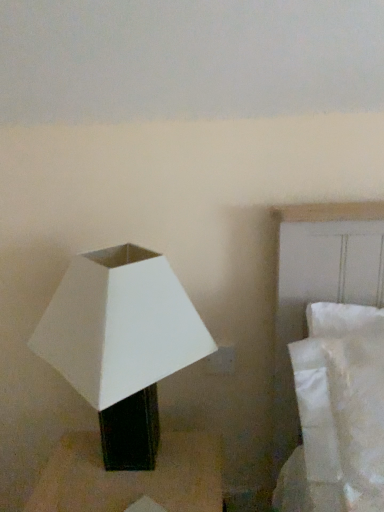
Question: Should I look upward or downward to see white matte lampshade at left?

Choices:
 (A) up
 (B) down

Answer: (B)